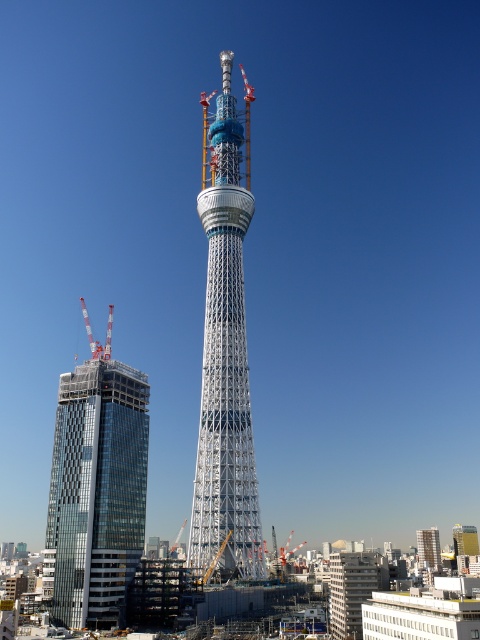
You are an architect observing the construction site. You need to determine the spatial relationship between the glassy modern skyscraper at left and the metallic construction crane at left. Which one is closer to you from your current viewpoint?

The glassy modern skyscraper at left is closer to you because it is in front of the metallic construction crane at left, obscuring part of the crane from your view.

You are a surveyor tasked with determining the position of the white metallic tower at center relative to the construction site. Based on the coordinates provided, can you confirm if the tower is centrally positioned within the site?

The white metallic tower at center is located at coordinates point (226, 349), which suggests it is centrally positioned within the construction site as its name implies.

You are an architect reviewing a construction site plan. You notice two points marked on the blueprint at coordinates point (199, 497) and point (107, 340). According to the blueprint, which point is closer to the viewer?

Point (199, 497) is in front of point (107, 340), so it is closer to the viewer.